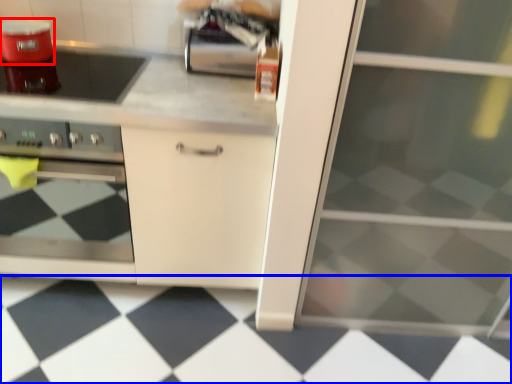
Question: Which point is further to the camera, kitchen appliance (highlighted by a red box) or tile (highlighted by a blue box)?

Choices:
 (A) kitchen appliance
 (B) tile

Answer: (A)